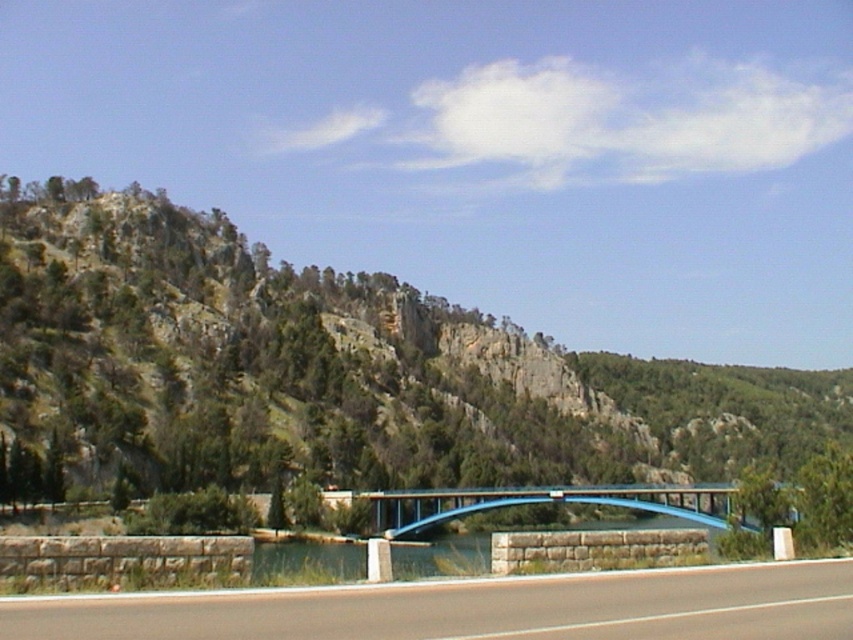
You are a hiker planning to travel from the green rocky mountain at upper left to the smooth asphalt highway at center. Based on the scene, what is the approximate distance you need to cover?

The distance between the green rocky mountain at upper left and the smooth asphalt highway at center is 168.57 meters, so you need to cover approximately 168.57 meters.

You are a hiker planning to take a photo of the blue metallic bridge at center and the green rocky mountain at upper left. Which object should you focus on first if you want to capture both in the same frame without moving your camera?

The green rocky mountain at upper left is bigger than the blue metallic bridge at center, so you should focus on the green rocky mountain at upper left first to ensure it fits within the frame before adjusting for the smaller bridge.

You are a delivery truck driver who needs to cross the bridge. The bridge has a weight limit of 10 tons. Your truck weighs 9.5 tons. The smooth asphalt highway at center is the bridge. Can you safely cross the bridge?

The smooth asphalt highway at center is the bridge, and since your truck weighs 9.5 tons which is under the 10 tons weight limit, you can safely cross the bridge.